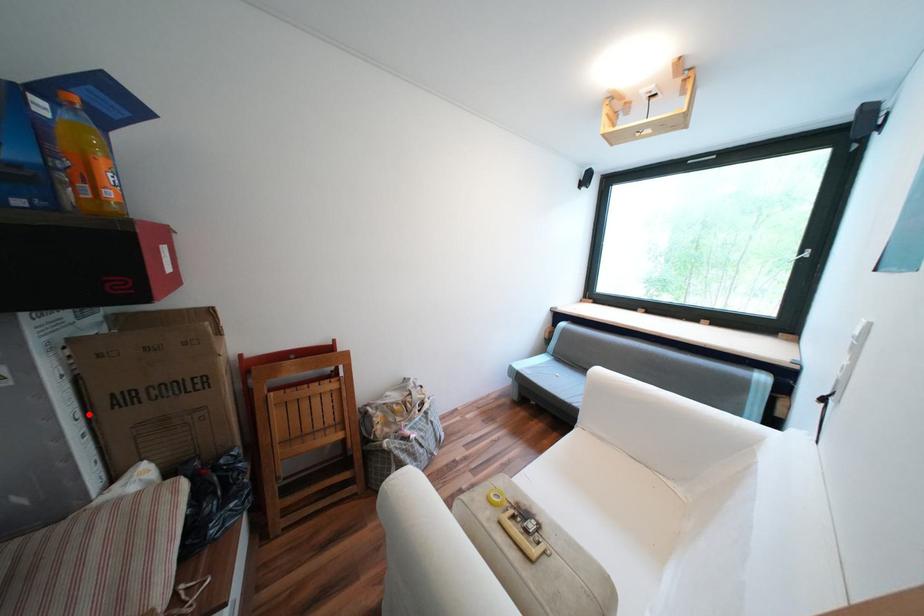
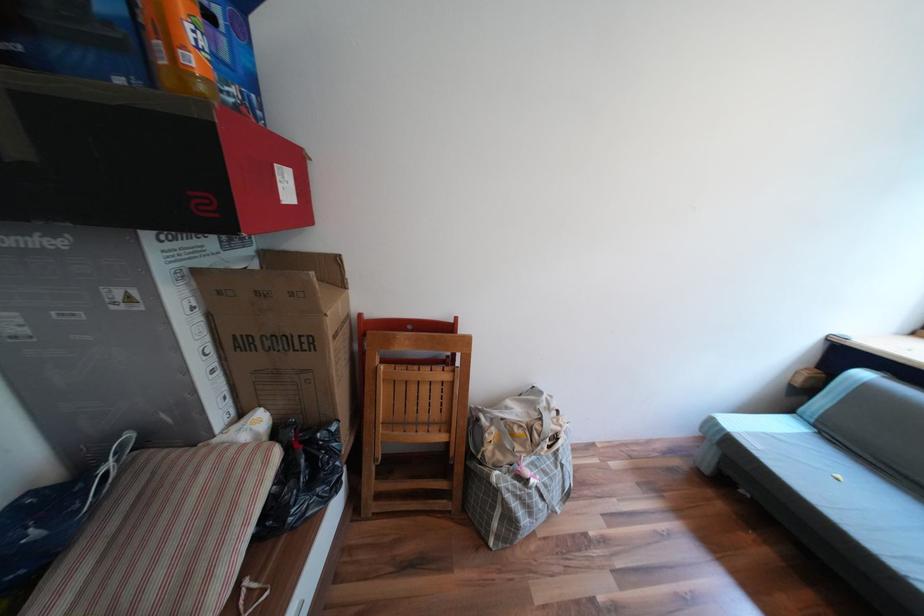
Where in the second image is the point corresponding to the highlighted location from the first image?

(219, 349)